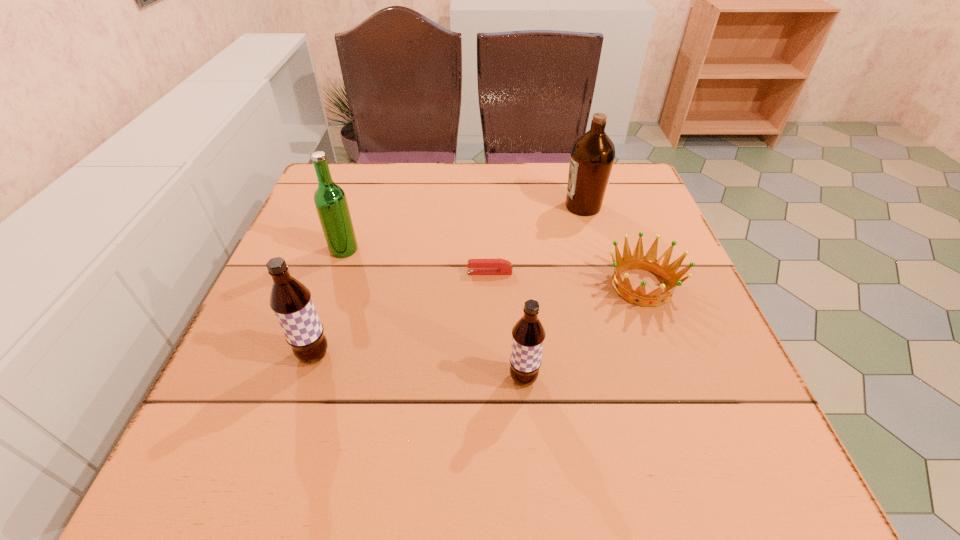
The width and height of the screenshot is (960, 540). In order to click on vacant region located 0.370m on the label of the olive oil in this screenshot , I will do (419, 206).

At what (x,y) coordinates should I click in order to perform the action: click on free space located on the label of the olive oil. Please return your answer as a coordinate pair (x, y). The height and width of the screenshot is (540, 960). Looking at the image, I should click on (458, 206).

I want to click on vacant space positioned on the back of the crown, so click(x=607, y=192).

Locate an element on the screen. The image size is (960, 540). free space located on the front-facing side of the shortest object is located at coordinates (338, 273).

Identify the location of vacant area situated on the front-facing side of the shortest object. This screenshot has width=960, height=540. (412, 273).

Locate an element on the screen. The image size is (960, 540). free point located 0.110m on the front-facing side of the shortest object is located at coordinates (417, 273).

Where is `free space located on the right of the beer bottle`? free space located on the right of the beer bottle is located at coordinates (420, 249).

Where is `object situated at the far edge`? This screenshot has width=960, height=540. object situated at the far edge is located at coordinates (592, 156).

The height and width of the screenshot is (540, 960). Find the location of `object that is at the near edge`. object that is at the near edge is located at coordinates (528, 334).

Locate an element on the screen. root beer at the left edge is located at coordinates (291, 301).